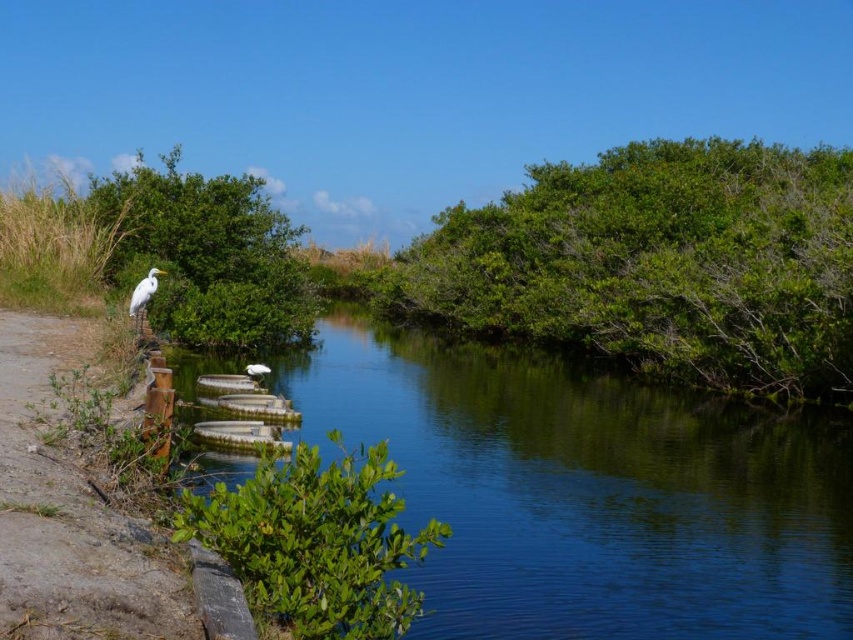
You are standing at the point marked by the coordinates point (659,264). Looking towards the waterway, which direction should you turn to face the metallic structures along the dirt path?

The point (659,264) marks the green leafy bush at upper right. Since the dirt path with metallic structures is on the left side of the waterway, you should turn to your left to face them.

You are a photographer planning to take a photo of the clear blue water at center and the green leafy bush at upper left. Based on their heights, which object should you focus on first if you want to capture both in a single frame without adjusting your camera angle?

The clear blue water at center is shorter than the green leafy bush at upper left, so you should focus on the clear blue water at center first to ensure both are in focus, as it is closer to the camera.